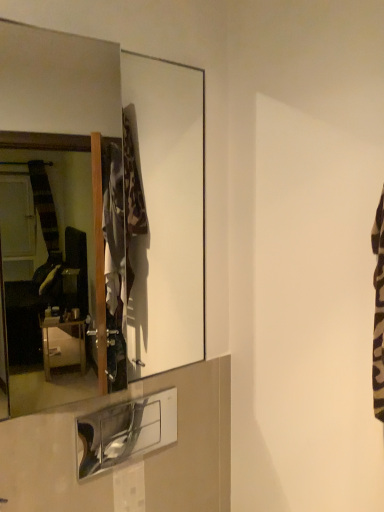
At what (x,y) coordinates should I click in order to perform the action: click on metallic silver shelf at lower center. Please return your answer as a coordinate pair (x, y). The image size is (384, 512). Looking at the image, I should click on (125, 431).

In order to face metallic silver shelf at lower center, should I rotate leftwards or rightwards?

You should look left and rotate roughly 7.911 degrees.

The height and width of the screenshot is (512, 384). Describe the element at coordinates (125, 431) in the screenshot. I see `metallic silver shelf at lower center` at that location.

Measure the distance between point (20, 288) and camera.

The distance of point (20, 288) from camera is 14.97 feet.

The height and width of the screenshot is (512, 384). Identify the location of matte glass mirror at upper left. (99, 213).

Describe the element at coordinates (99, 213) in the screenshot. Image resolution: width=384 pixels, height=512 pixels. I see `matte glass mirror at upper left` at that location.

The height and width of the screenshot is (512, 384). I want to click on metallic silver shelf at lower center, so click(x=125, y=431).

Which object is positioned more to the left, matte glass mirror at upper left or metallic silver shelf at lower center?

From the viewer's perspective, matte glass mirror at upper left appears more on the left side.

Considering their positions, is matte glass mirror at upper left located in front of or behind metallic silver shelf at lower center?

matte glass mirror at upper left is in front of metallic silver shelf at lower center.

Is point (125, 228) farther from camera compared to point (146, 434)?

Yes, it is.

From the image's perspective, would you say matte glass mirror at upper left is positioned over metallic silver shelf at lower center?

Yes.

From a real-world perspective, does matte glass mirror at upper left stand above metallic silver shelf at lower center?

Yes, from a real-world perspective, matte glass mirror at upper left is above metallic silver shelf at lower center.

Can you confirm if matte glass mirror at upper left is wider than metallic silver shelf at lower center?

Yes, matte glass mirror at upper left is wider than metallic silver shelf at lower center.

Considering the sizes of objects matte glass mirror at upper left and metallic silver shelf at lower center in the image provided, who is shorter, matte glass mirror at upper left or metallic silver shelf at lower center?

metallic silver shelf at lower center is shorter.

Does matte glass mirror at upper left have a smaller size compared to metallic silver shelf at lower center?

Incorrect, matte glass mirror at upper left is not smaller in size than metallic silver shelf at lower center.

Would you say matte glass mirror at upper left is outside metallic silver shelf at lower center?

Indeed, matte glass mirror at upper left is completely outside metallic silver shelf at lower center.

Is matte glass mirror at upper left far from metallic silver shelf at lower center?

matte glass mirror at upper left is positioned a significant distance from metallic silver shelf at lower center.

Based on the photo, could you tell me if matte glass mirror at upper left is facing metallic silver shelf at lower center?

No, matte glass mirror at upper left does not turn towards metallic silver shelf at lower center.

Find the location of a particular element. This screenshot has width=384, height=512. shelf behind the matte glass mirror at upper left is located at coordinates [x=125, y=431].

Which object is positioned more to the right, metallic silver shelf at lower center or matte glass mirror at upper left?

metallic silver shelf at lower center is more to the right.

From the picture: Is metallic silver shelf at lower center positioned behind matte glass mirror at upper left?

Yes, metallic silver shelf at lower center is further from the viewer.

Which point is more distant from viewer, (106, 459) or (137, 296)?

The point (137, 296) is farther.

From the image's perspective, which one is positioned higher, metallic silver shelf at lower center or matte glass mirror at upper left?

matte glass mirror at upper left.

From a real-world perspective, which is physically above, metallic silver shelf at lower center or matte glass mirror at upper left?

From a 3D spatial view, matte glass mirror at upper left is above.

Is metallic silver shelf at lower center thinner than matte glass mirror at upper left?

Yes.

In terms of height, does metallic silver shelf at lower center look taller or shorter compared to matte glass mirror at upper left?

Considering their sizes, metallic silver shelf at lower center has less height than matte glass mirror at upper left.

Does metallic silver shelf at lower center have a larger size compared to matte glass mirror at upper left?

No.

Is matte glass mirror at upper left a part of metallic silver shelf at lower center?

No, matte glass mirror at upper left is not inside metallic silver shelf at lower center.

Is metallic silver shelf at lower center next to matte glass mirror at upper left?

metallic silver shelf at lower center is not next to matte glass mirror at upper left, and they're not touching.

Is matte glass mirror at upper left at the back of metallic silver shelf at lower center?

metallic silver shelf at lower center does not have its back to matte glass mirror at upper left.

What's the angular difference between metallic silver shelf at lower center and matte glass mirror at upper left's facing directions?

The facing directions of metallic silver shelf at lower center and matte glass mirror at upper left are 1.59 degrees apart.

Image resolution: width=384 pixels, height=512 pixels. Identify the location of mirror on the left side of metallic silver shelf at lower center. (99, 213).

I want to click on mirror located above the metallic silver shelf at lower center (from a real-world perspective), so click(99, 213).

At what (x,y) coordinates should I click in order to perform the action: click on mirror on the left of metallic silver shelf at lower center. Please return your answer as a coordinate pair (x, y). This screenshot has width=384, height=512. Looking at the image, I should click on (99, 213).